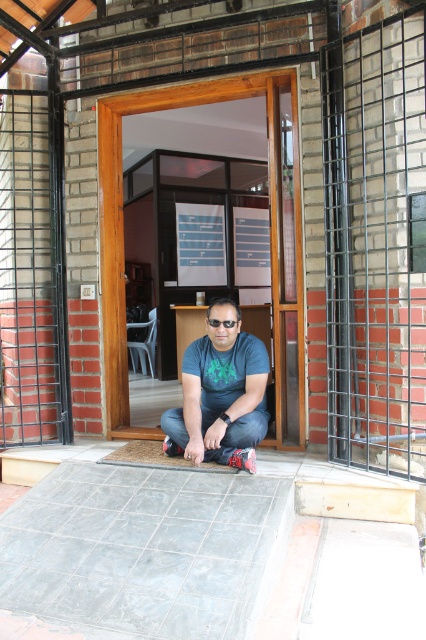
In the scene shown: Between wooden door at center and matte blue shirt at center, which one appears on the left side from the viewer's perspective?

wooden door at center is more to the left.

Does wooden door at center have a larger size compared to matte blue shirt at center?

Indeed, wooden door at center has a larger size compared to matte blue shirt at center.

Is point (293, 305) positioned after point (215, 362)?

Yes.

You are a GUI agent. You are given a task and a screenshot of the screen. Output one action in this format:
    pyautogui.click(x=<x>, y=<y>)
    Task: Click on the wooden door at center
    The width and height of the screenshot is (426, 640).
    Given the screenshot: What is the action you would take?
    pyautogui.click(x=270, y=237)

Is black metal gate at left above wooden door at center?

No.

Does black metal gate at left have a greater height compared to wooden door at center?

Yes.

Find the location of a particular element. This screenshot has height=640, width=426. black metal gate at left is located at coordinates (32, 272).

Locate an element on the screen. Image resolution: width=426 pixels, height=640 pixels. black metal grid at right is located at coordinates (376, 243).

Based on the photo, does black metal grid at right have a lesser height compared to wooden door at center?

Indeed, black metal grid at right has a lesser height compared to wooden door at center.

In the scene shown: Measure the distance between black metal grid at right and camera.

black metal grid at right is 8.82 feet from camera.

You are a GUI agent. You are given a task and a screenshot of the screen. Output one action in this format:
    pyautogui.click(x=<x>, y=<y>)
    Task: Click on the black metal grid at right
    This screenshot has width=426, height=640.
    Given the screenshot: What is the action you would take?
    pyautogui.click(x=376, y=243)